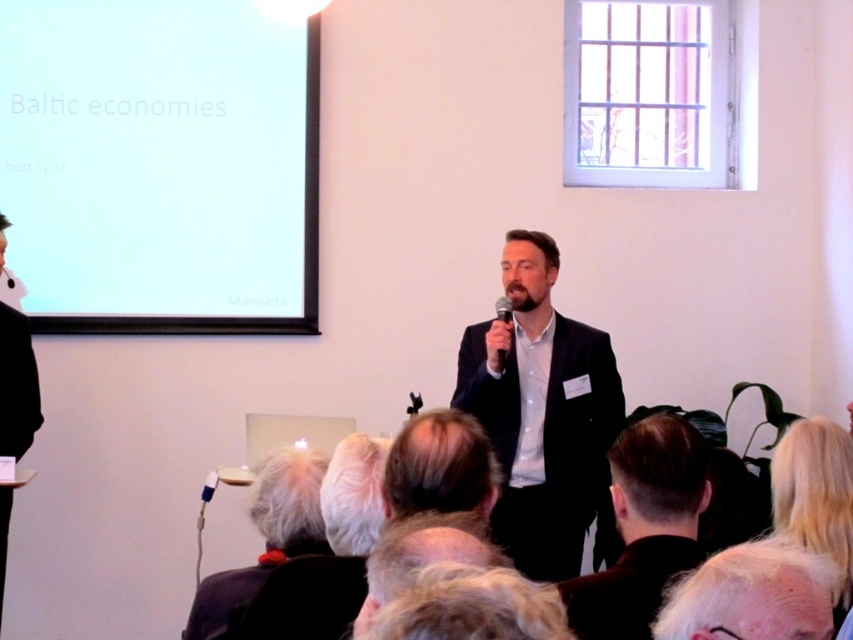
Does dark suit at center have a lesser height compared to gray hair at center?

No, dark suit at center is not shorter than gray hair at center.

Which is behind, point (524, 275) or point (424, 424)?

The point (524, 275) is more distant.

Identify the location of dark suit at center. (544, 417).

Who is positioned more to the left, blonde hair at upper right or white hair at center?

white hair at center is more to the left.

Is point (827, 531) farther from camera compared to point (328, 518)?

Yes, it is.

Does point (844, 600) come farther from viewer compared to point (325, 500)?

Yes.

Locate an element on the screen. Image resolution: width=853 pixels, height=640 pixels. blonde hair at upper right is located at coordinates (816, 496).

Can you confirm if dark suit at center is positioned above dark brown hair at center?

No, dark suit at center is not above dark brown hair at center.

This screenshot has width=853, height=640. What do you see at coordinates (544, 417) in the screenshot?
I see `dark suit at center` at bounding box center [544, 417].

The image size is (853, 640). What do you see at coordinates (544, 417) in the screenshot? I see `dark suit at center` at bounding box center [544, 417].

I want to click on dark suit at center, so click(544, 417).